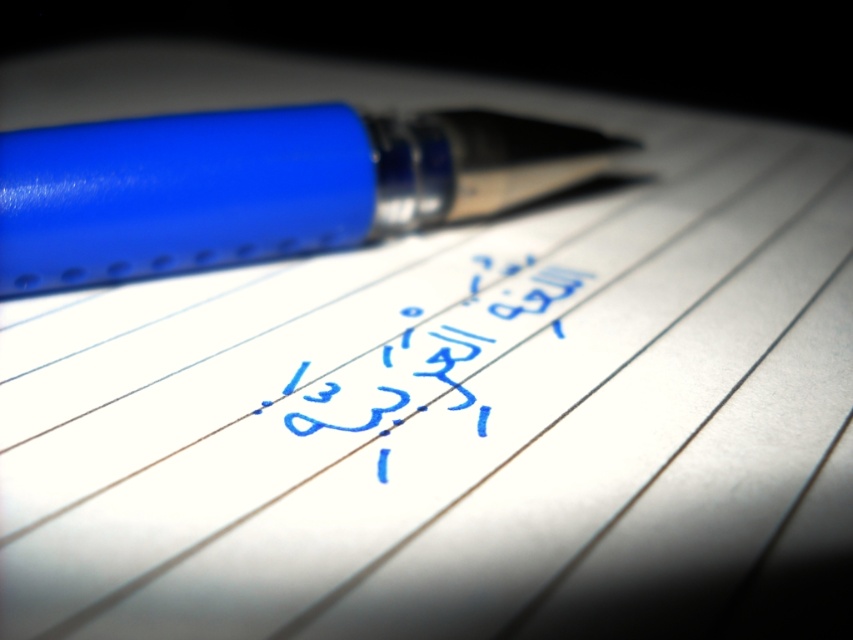
Can you confirm if matte blue pen at upper left is taller than blue ink writing at center?

Yes.

Can you confirm if matte blue pen at upper left is shorter than blue ink writing at center?

In fact, matte blue pen at upper left may be taller than blue ink writing at center.

Is point (457, 118) farther from camera compared to point (387, 416)?

Yes.

Where is `matte blue pen at upper left`? This screenshot has height=640, width=853. matte blue pen at upper left is located at coordinates (262, 186).